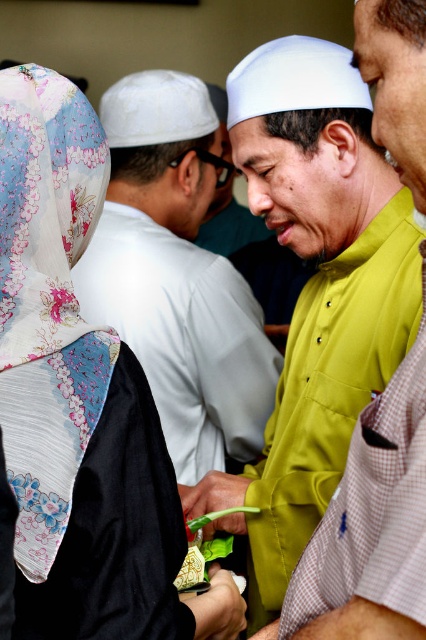
Is green matte shirt at center further to camera compared to matte yellow shirt at center?

No, green matte shirt at center is in front of matte yellow shirt at center.

Does point (304, 417) lie in front of point (236, 433)?

That is True.

Locate an element on the screen. This screenshot has width=426, height=640. green matte shirt at center is located at coordinates (316, 289).

Between green matte shirt at center and floral silk hijab at upper left, which one appears on the left side from the viewer's perspective?

floral silk hijab at upper left

Between point (414, 282) and point (42, 237), which one is positioned behind?

The point (414, 282) is more distant.

Image resolution: width=426 pixels, height=640 pixels. Identify the location of green matte shirt at center. (316, 289).

Does floral-patterned fabric headscarf at upper left appear on the left side of matte yellow shirt at center?

Correct, you'll find floral-patterned fabric headscarf at upper left to the left of matte yellow shirt at center.

Between floral-patterned fabric headscarf at upper left and matte yellow shirt at center, which one has more height?

matte yellow shirt at center

This screenshot has height=640, width=426. In order to click on floral-patterned fabric headscarf at upper left in this screenshot , I will do `click(80, 401)`.

Find the location of a particular element. The width and height of the screenshot is (426, 640). floral-patterned fabric headscarf at upper left is located at coordinates (80, 401).